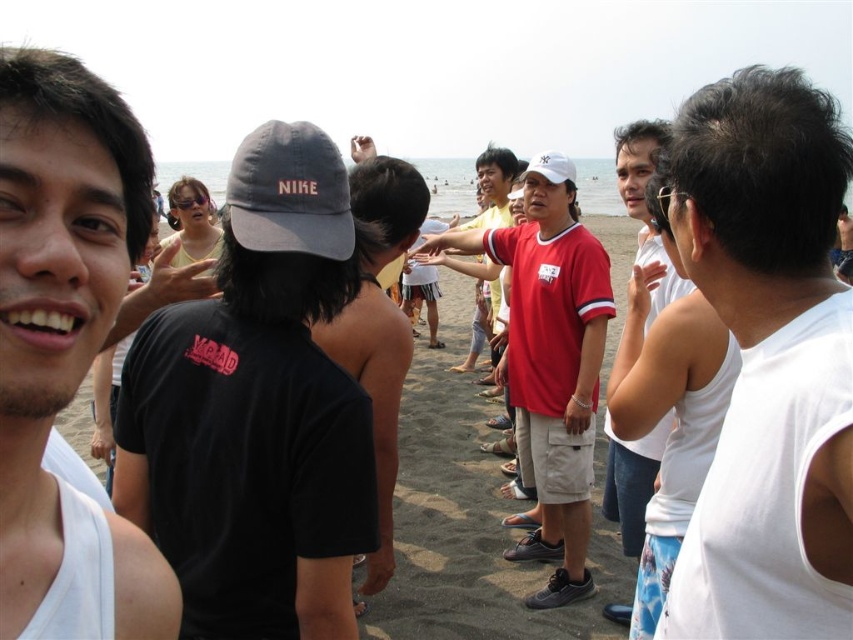
Which is behind, point (538, 216) or point (418, 195)?

The point (538, 216) is more distant.

Is red matte shirt at center thinner than black matte cap at center?

No, red matte shirt at center is not thinner than black matte cap at center.

This screenshot has height=640, width=853. I want to click on red matte shirt at center, so click(550, 369).

Where is `red matte shirt at center`? The width and height of the screenshot is (853, 640). red matte shirt at center is located at coordinates (550, 369).

This screenshot has height=640, width=853. What do you see at coordinates (767, 358) in the screenshot?
I see `white tank top at right` at bounding box center [767, 358].

Does white tank top at right have a lesser height compared to white matte baseball cap at center?

No, white tank top at right is not shorter than white matte baseball cap at center.

Does point (740, 573) come behind point (531, 172)?

No, (740, 573) is in front of (531, 172).

This screenshot has width=853, height=640. In order to click on white tank top at right in this screenshot , I will do `click(767, 358)`.

Is the position of black matte t-shirt at center more distant than that of red matte shirt at center?

No.

Which is behind, point (198, 490) or point (553, 216)?

The point (553, 216) is behind.

Consider the image. Who is more distant from viewer, [216,602] or [531,216]?

The point [531,216] is more distant.

Identify the location of black matte t-shirt at center. (257, 410).